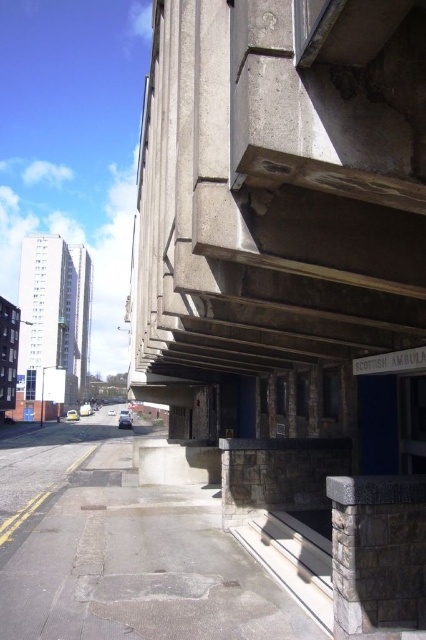
Question: Where is concrete at upper right located in relation to gray stone pillar at lower right in the image?

Choices:
 (A) left
 (B) right

Answer: (A)

Question: Considering the relative positions of concrete at upper right and gray stone pillar at lower right in the image provided, where is concrete at upper right located with respect to gray stone pillar at lower right?

Choices:
 (A) left
 (B) right

Answer: (A)

Question: From the image, what is the correct spatial relationship of concrete at upper right in relation to gray stone pillar at lower right?

Choices:
 (A) below
 (B) above

Answer: (B)

Question: Which point appears closest to the camera in this image?

Choices:
 (A) (354, 632)
 (B) (152, 333)

Answer: (A)

Question: Which object is closer to the camera taking this photo?

Choices:
 (A) gray stone pillar at lower right
 (B) concrete at upper right

Answer: (B)